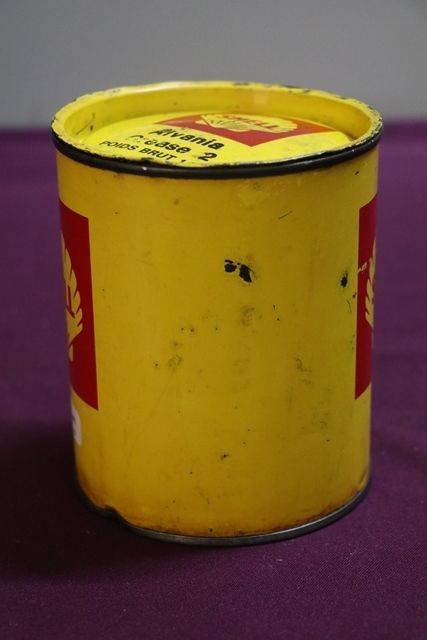
The width and height of the screenshot is (427, 640). Identify the location of gray wall. (244, 34).